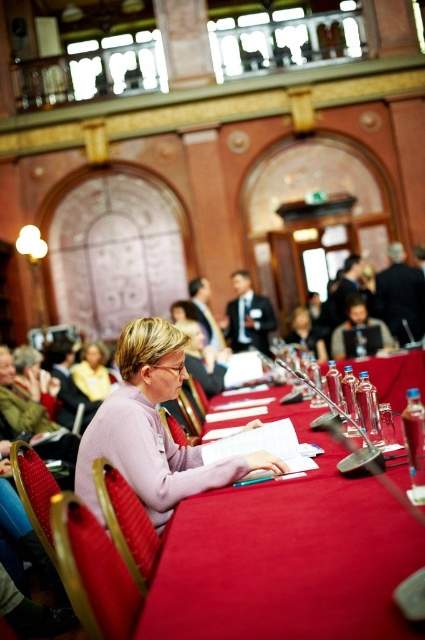
Question: Considering the relative positions of smooth red table at center and pink matte sweater at center in the image provided, where is smooth red table at center located with respect to pink matte sweater at center?

Choices:
 (A) right
 (B) left

Answer: (A)

Question: Which is farther from the smooth red table at center?

Choices:
 (A) pink matte sweater at center
 (B) matte yellow shirt at lower left

Answer: (B)

Question: Does pink matte sweater at center have a lesser width compared to matte yellow shirt at lower left?

Choices:
 (A) no
 (B) yes

Answer: (A)

Question: Which point is closer to the camera taking this photo?

Choices:
 (A) (74, 381)
 (B) (129, 444)
 (C) (152, 618)

Answer: (C)

Question: Which point appears closest to the camera in this image?

Choices:
 (A) (413, 358)
 (B) (73, 372)
 (C) (180, 456)

Answer: (C)

Question: Can you confirm if smooth red table at center is bigger than pink matte sweater at center?

Choices:
 (A) yes
 (B) no

Answer: (B)